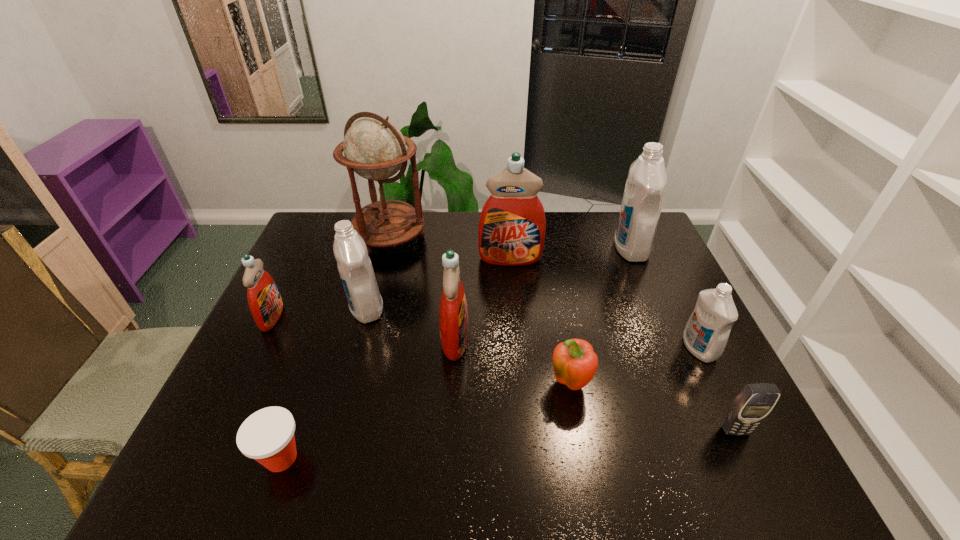
At what (x,y) coordinates should I click in order to perform the action: click on the second closest object relative to the smallest red detergent. Please return your answer as a coordinate pair (x, y). Looking at the image, I should click on (374, 148).

Locate which detergent is the third closest to the second red detergent from right to left. Please provide its 2D coordinates. Your answer should be formatted as a tuple, i.e. [(x, y)], where the tuple contains the x and y coordinates of a point satisfying the conditions above.

[(265, 303)]

Where is `detergent that stands as the closest to the sixth object from right to left`? detergent that stands as the closest to the sixth object from right to left is located at coordinates (355, 268).

What are the coordinates of `white detergent that is the nearest to the biggest red detergent` in the screenshot? It's located at (644, 191).

Select which white detergent appears as the third closest to the second red detergent from left to right. Please provide its 2D coordinates. Your answer should be formatted as a tuple, i.e. [(x, y)], where the tuple contains the x and y coordinates of a point satisfying the conditions above.

[(706, 333)]

Locate an element on the screen. red detergent that is the nearest to the pepper is located at coordinates (453, 315).

Where is `red detergent that is the closest to the leftmost red detergent`? This screenshot has height=540, width=960. red detergent that is the closest to the leftmost red detergent is located at coordinates (453, 315).

Identify the location of blank space that satisfies the following two spatial constraints: 1. on the front surface of the biggest red detergent; 2. on the front surface of the second red detergent from left to right. (517, 339).

Identify the location of free location that satisfies the following two spatial constraints: 1. on the front surface of the smallest red detergent; 2. on the back side of the Dixie cup. This screenshot has height=540, width=960. (204, 458).

This screenshot has height=540, width=960. I want to click on vacant area in the image that satisfies the following two spatial constraints: 1. on the front surface of the farthest red detergent; 2. on the front surface of the smallest red detergent, so click(516, 317).